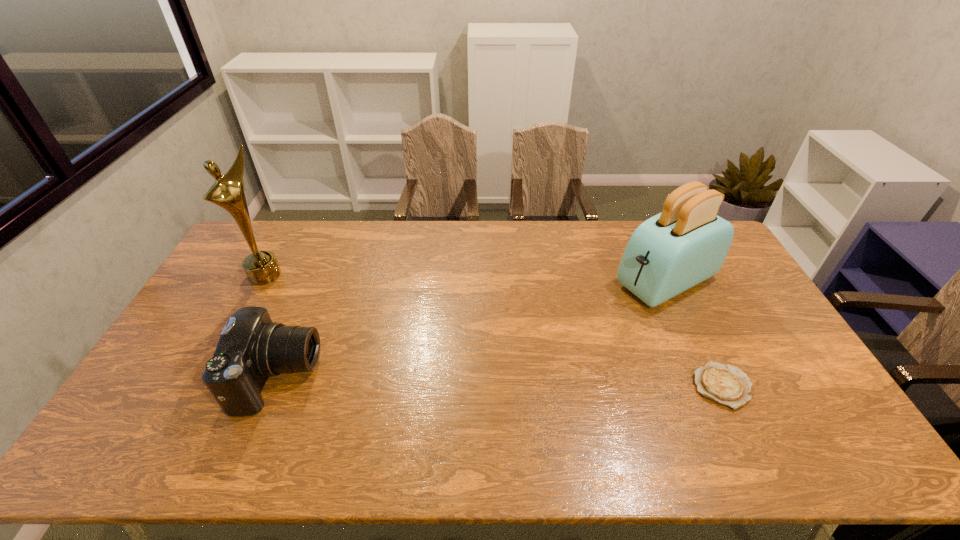
Locate an element on the screen. free area in between the shortest object and the leftmost object is located at coordinates (493, 330).

Image resolution: width=960 pixels, height=540 pixels. Identify the location of object that is the third nearest to the second object from left to right. (727, 385).

Locate an element on the screen. The height and width of the screenshot is (540, 960). object that stands as the closest to the toaster is located at coordinates (727, 385).